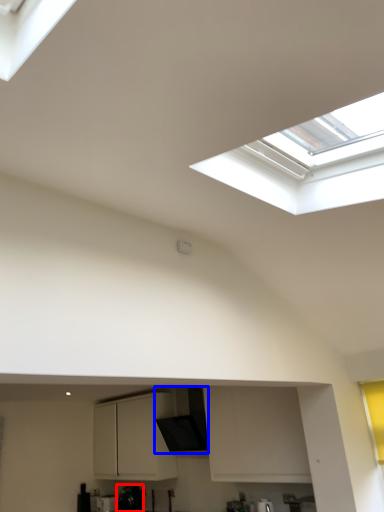
Question: Which object is further to the camera taking this photo, appliance (highlighted by a red box) or exhaust hood (highlighted by a blue box)?

Choices:
 (A) appliance
 (B) exhaust hood

Answer: (A)